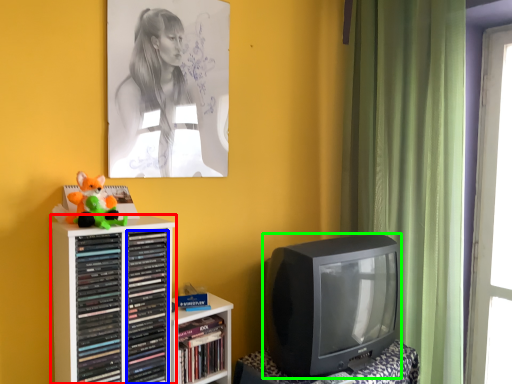
Question: Considering the real-world distances, which object is closest to shelf (highlighted by a red box)? book (highlighted by a blue box) or television (highlighted by a green box).

Choices:
 (A) book
 (B) television

Answer: (A)